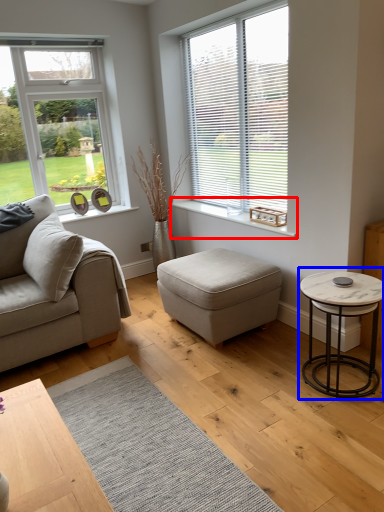
Question: Among these objects, which one is farthest to the camera, window sill (highlighted by a red box) or coffee table (highlighted by a blue box)?

Choices:
 (A) window sill
 (B) coffee table

Answer: (A)